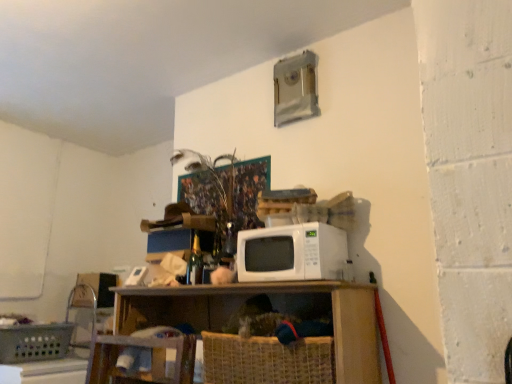
Question: Does plastic woven basket at lower left, which is the second basket in right-to-left order, contain wooden shelf at center?

Choices:
 (A) yes
 (B) no

Answer: (B)

Question: Can you confirm if plastic woven basket at lower left, the first basket viewed from the back, is bigger than wooden shelf at center?

Choices:
 (A) yes
 (B) no

Answer: (B)

Question: Is plastic woven basket at lower left, marked as the 2th basket in a front-to-back arrangement, far from wooden shelf at center?

Choices:
 (A) no
 (B) yes

Answer: (B)

Question: Can you confirm if plastic woven basket at lower left, the first basket viewed from the back, is wider than wooden shelf at center?

Choices:
 (A) yes
 (B) no

Answer: (A)

Question: Can you confirm if plastic woven basket at lower left, which is the second basket in right-to-left order, is smaller than wooden shelf at center?

Choices:
 (A) yes
 (B) no

Answer: (A)

Question: In terms of width, does woven straw basket at lower center, the second basket positioned from the left, look wider or thinner when compared to white matte microwave at center?

Choices:
 (A) thin
 (B) wide

Answer: (B)

Question: From their relative heights in the image, would you say woven straw basket at lower center, marked as the first basket in a right-to-left arrangement, is taller or shorter than white matte microwave at center?

Choices:
 (A) short
 (B) tall

Answer: (B)

Question: From a real-world perspective, is woven straw basket at lower center, the 1th basket positioned from the front, above or below white matte microwave at center?

Choices:
 (A) above
 (B) below

Answer: (B)

Question: Considering their positions, is woven straw basket at lower center, marked as the first basket in a right-to-left arrangement, located in front of or behind white matte microwave at center?

Choices:
 (A) behind
 (B) front

Answer: (B)

Question: In terms of height, does wooden shelf at center look taller or shorter compared to white matte microwave at center?

Choices:
 (A) tall
 (B) short

Answer: (A)

Question: Is wooden shelf at center wider or thinner than white matte microwave at center?

Choices:
 (A) wide
 (B) thin

Answer: (A)

Question: Based on their positions, is wooden shelf at center located to the left or right of white matte microwave at center?

Choices:
 (A) right
 (B) left

Answer: (B)

Question: Considering the positions of point (345, 379) and point (287, 251), is point (345, 379) closer or farther from the camera than point (287, 251)?

Choices:
 (A) farther
 (B) closer

Answer: (B)

Question: Considering the positions of white matte microwave at center and woven straw basket at lower center, the second basket positioned from the left, in the image, is white matte microwave at center bigger or smaller than woven straw basket at lower center, the second basket positioned from the left,?

Choices:
 (A) small
 (B) big

Answer: (A)

Question: Considering their positions, is white matte microwave at center located in front of or behind woven straw basket at lower center, marked as the first basket in a right-to-left arrangement?

Choices:
 (A) behind
 (B) front

Answer: (A)